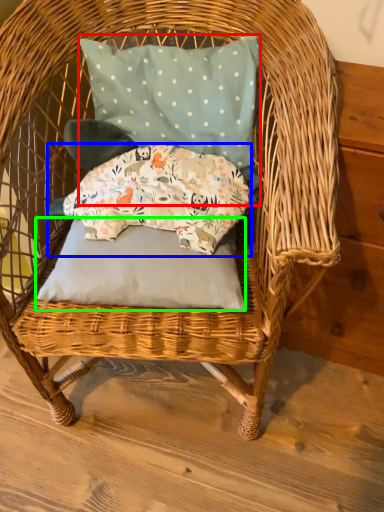
Question: Which object is the farthest from pillow (highlighted by a red box)? Choose among these: pillow (highlighted by a blue box) or pillow (highlighted by a green box).

Choices:
 (A) pillow
 (B) pillow

Answer: (B)